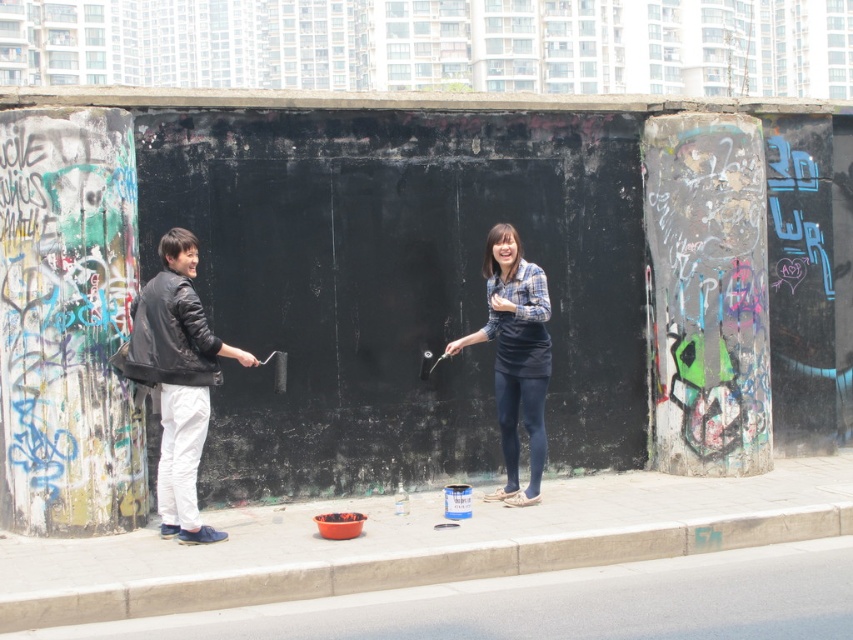
Question: Can you confirm if black leather jacket at left is smaller than blue plaid shirt at center?

Choices:
 (A) yes
 (B) no

Answer: (B)

Question: Which point is farther from the camera taking this photo?

Choices:
 (A) (184, 534)
 (B) (492, 275)

Answer: (B)

Question: Is black leather jacket at left smaller than blue plaid shirt at center?

Choices:
 (A) yes
 (B) no

Answer: (B)

Question: Which of the following is the farthest from the observer?

Choices:
 (A) blue plaid shirt at center
 (B) black leather jacket at left

Answer: (A)

Question: Which point is farther to the camera?

Choices:
 (A) (544, 326)
 (B) (210, 337)

Answer: (A)

Question: Is black leather jacket at left thinner than blue plaid shirt at center?

Choices:
 (A) no
 (B) yes

Answer: (A)